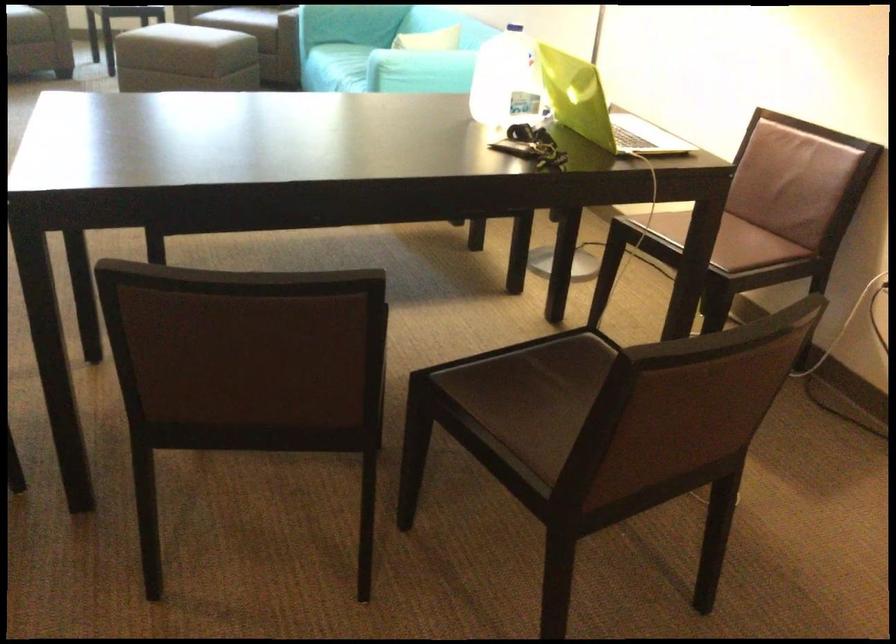
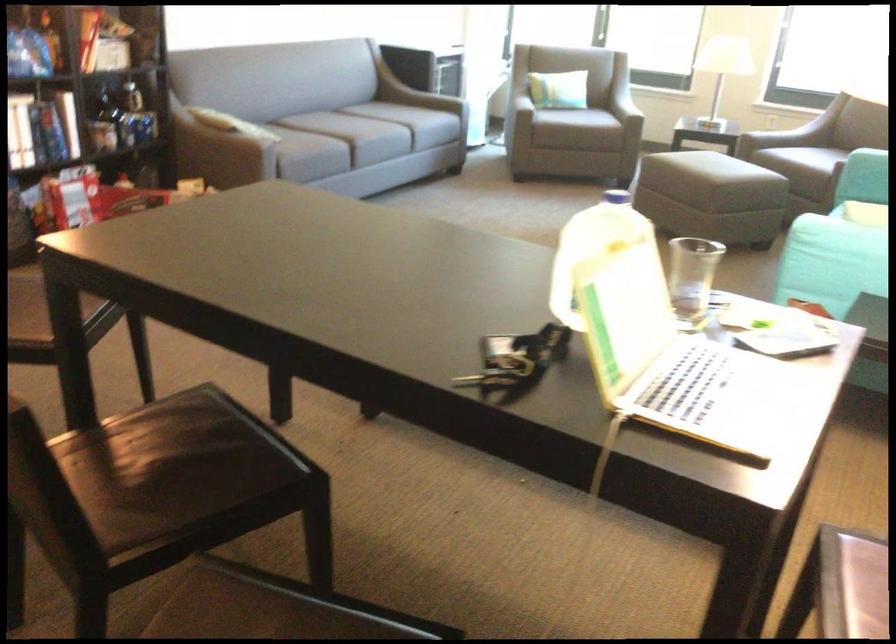
The first image is from the beginning of the video and the second image is from the end. How did the camera likely rotate when shooting the video?

The camera rotated toward right-down.